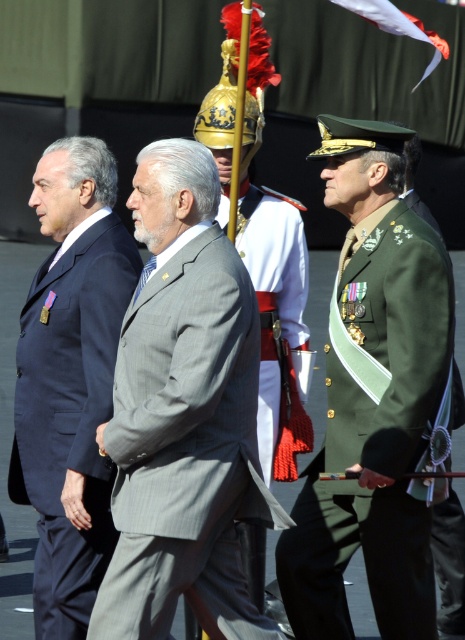
Question: Does gray pinstripe suit at center have a larger size compared to white fabric flag at upper center?

Choices:
 (A) yes
 (B) no

Answer: (B)

Question: From the image, what is the correct spatial relationship of gray pinstripe suit at center in relation to white fabric flag at upper center?

Choices:
 (A) below
 (B) above

Answer: (A)

Question: Which of these objects is positioned closest to the gray pinstripe suit at center?

Choices:
 (A) green military uniform at center
 (B) white fabric flag at upper center
 (C) matte black suit at left

Answer: (C)

Question: Which object is positioned farthest from the green military uniform at center?

Choices:
 (A) gray pinstripe suit at center
 (B) matte black suit at left
 (C) white fabric flag at upper center

Answer: (C)

Question: Which point is farther from the camera taking this photo?

Choices:
 (A) (50, 611)
 (B) (152, 540)
 (C) (312, 611)

Answer: (C)

Question: Considering the relative positions of gray pinstripe suit at center and white fabric flag at upper center in the image provided, where is gray pinstripe suit at center located with respect to white fabric flag at upper center?

Choices:
 (A) below
 (B) above

Answer: (A)